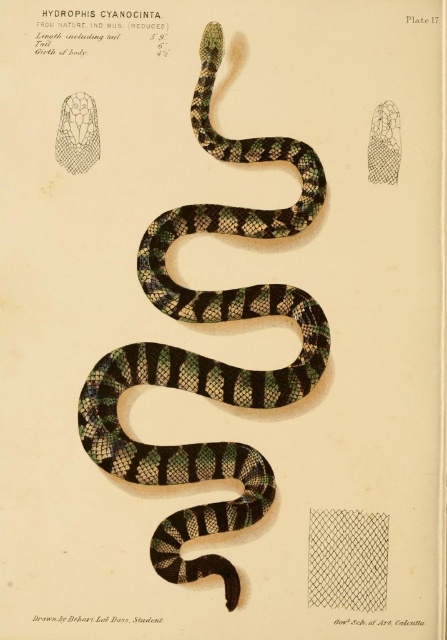
Between green and black striped snake at center and netted fabric at center, which one appears on the right side from the viewer's perspective?

netted fabric at center

This screenshot has height=640, width=447. Describe the element at coordinates (207, 356) in the screenshot. I see `green and black striped snake at center` at that location.

Between point (207, 212) and point (316, 561), which one is positioned in front?

Point (316, 561)

You are a GUI agent. You are given a task and a screenshot of the screen. Output one action in this format:
    pyautogui.click(x=<x>, y=<y>)
    Task: Click on the green and black striped snake at center
    The image size is (447, 640).
    Given the screenshot: What is the action you would take?
    pyautogui.click(x=207, y=356)